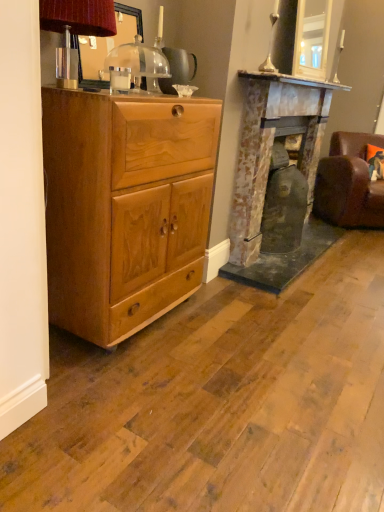
Question: Is brown leather swivel chair at right taller or shorter than matte brown lampshade at upper left?

Choices:
 (A) tall
 (B) short

Answer: (A)

Question: Considering the positions of point (380, 212) and point (77, 86), is point (380, 212) closer or farther from the camera than point (77, 86)?

Choices:
 (A) farther
 (B) closer

Answer: (A)

Question: Considering the real-world distances, which object is closest to the brown leather swivel chair at right?

Choices:
 (A) light brown wood chest of drawers at left
 (B) rustic stone fireplace at center
 (C) matte brown lampshade at upper left

Answer: (B)

Question: Estimate the real-world distances between objects in this image. Which object is closer to the brown leather swivel chair at right?

Choices:
 (A) light brown wood chest of drawers at left
 (B) rustic stone fireplace at center
 (C) matte brown lampshade at upper left

Answer: (B)